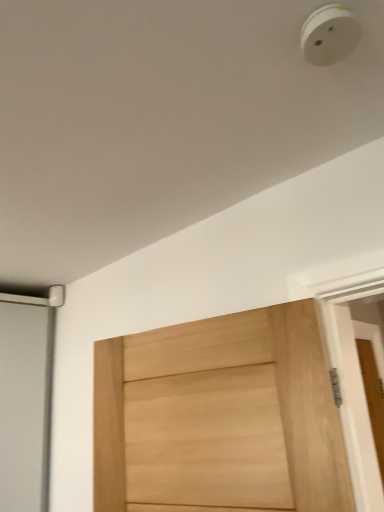
This screenshot has width=384, height=512. What do you see at coordinates (329, 35) in the screenshot?
I see `white plastic smoke detector at upper center` at bounding box center [329, 35].

This screenshot has width=384, height=512. I want to click on white plastic smoke detector at upper center, so click(329, 35).

I want to click on white plastic smoke detector at upper center, so click(329, 35).